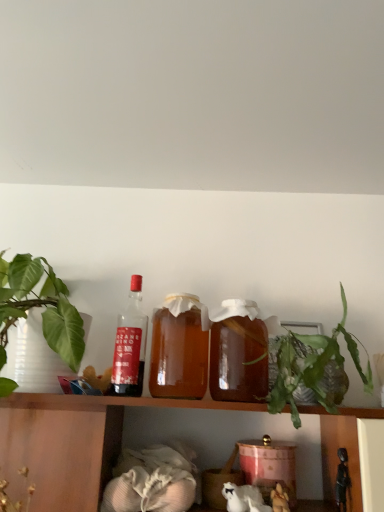
Question: In terms of height, does fluffy white stuffed animal at lower center, acting as the 2th toy starting from the right, look taller or shorter compared to green leafy plant at right?

Choices:
 (A) tall
 (B) short

Answer: (B)

Question: In terms of width, does fluffy white stuffed animal at lower center, acting as the 2th toy starting from the right, look wider or thinner when compared to green leafy plant at right?

Choices:
 (A) wide
 (B) thin

Answer: (B)

Question: Considering the real-world distances, which object is farthest from the translucent glass bottle at center, which is counted as the 2th bottle, starting from the right?

Choices:
 (A) shiny black figurine at lower right, arranged as the 2th toy when viewed from the left
 (B) white fur cat at lower center
 (C) fluffy white stuffed animal at lower center, acting as the 2th toy starting from the right
 (D) matte glass bottle at left, marked as the 1th bottle in a left-to-right arrangement
 (E) translucent glass bottle at center, the 1th bottle positioned from the right

Answer: (A)

Question: Estimate the real-world distances between objects in this image. Which object is closer to the translucent glass bottle at center, positioned as the 3th bottle in left-to-right order?

Choices:
 (A) matte glass bottle at left, marked as the 1th bottle in a left-to-right arrangement
 (B) white fur cat at lower center
 (C) fluffy white stuffed animal at lower center, the first toy when ordered from left to right
 (D) shiny black figurine at lower right, arranged as the 2th toy when viewed from the left
 (E) green leafy plant at right

Answer: (E)